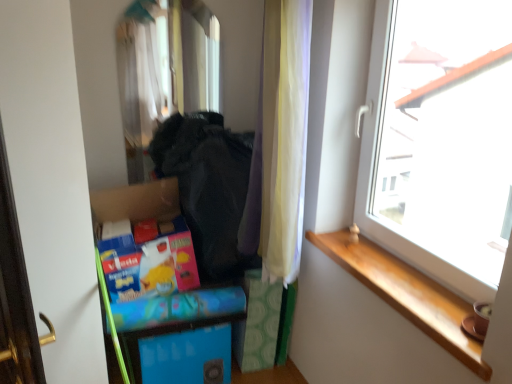
The image size is (512, 384). What do you see at coordinates (280, 144) in the screenshot?
I see `white sheer curtain at center` at bounding box center [280, 144].

Measure the distance between transparent glass window at upper right and camera.

transparent glass window at upper right is 3.89 feet from camera.

Identify the location of white sheer curtain at center. coord(280,144).

Looking at this image, from a real-world perspective, which is physically above, white sheer curtain at center or blue cardboard box at lower center?

white sheer curtain at center.

Consider the image. From the image's perspective, which is below, white sheer curtain at center or blue cardboard box at lower center?

From the image's view, blue cardboard box at lower center is below.

Would you say white sheer curtain at center is inside or outside blue cardboard box at lower center?

white sheer curtain at center cannot be found inside blue cardboard box at lower center.

In the scene shown: Considering the sizes of white sheer curtain at center and blue cardboard box at lower center in the image, is white sheer curtain at center wider or thinner than blue cardboard box at lower center?

Clearly, white sheer curtain at center has more width compared to blue cardboard box at lower center.

Do you think blue cardboard box at lower center is within shiny glass mirror at upper center, or outside of it?

blue cardboard box at lower center is located beyond the bounds of shiny glass mirror at upper center.

What's the angular difference between blue cardboard box at lower center and shiny glass mirror at upper center's facing directions?

The facing directions of blue cardboard box at lower center and shiny glass mirror at upper center are 4.9 degrees apart.

Does blue cardboard box at lower center have a lesser height compared to shiny glass mirror at upper center?

Correct, blue cardboard box at lower center is not as tall as shiny glass mirror at upper center.

Can you confirm if green matte screen door at left is positioned to the right of white sheer curtain at center?

In fact, green matte screen door at left is to the left of white sheer curtain at center.

Is white sheer curtain at center inside green matte screen door at left?

No.

Is green matte screen door at left facing towards white sheer curtain at center?

No, green matte screen door at left is not turned towards white sheer curtain at center.

In the scene shown: In terms of size, does green matte screen door at left appear bigger or smaller than white sheer curtain at center?

green matte screen door at left is bigger than white sheer curtain at center.

Is green matte screen door at left surrounded by shiny glass mirror at upper center?

No, green matte screen door at left is not surrounded by shiny glass mirror at upper center.

Between point (170, 55) and point (32, 90), which one is positioned behind?

The point (170, 55) is farther from the camera.

From their relative heights in the image, would you say shiny glass mirror at upper center is taller or shorter than green matte screen door at left?

Clearly, shiny glass mirror at upper center is shorter compared to green matte screen door at left.

Who is smaller, shiny glass mirror at upper center or green matte screen door at left?

shiny glass mirror at upper center.

Could you tell me if green matte screen door at left is facing transparent glass window at upper right?

No, green matte screen door at left is not facing towards transparent glass window at upper right.

Is transparent glass window at upper right surrounded by green matte screen door at left?

No, transparent glass window at upper right is located outside of green matte screen door at left.

Which is behind, green matte screen door at left or transparent glass window at upper right?

transparent glass window at upper right is further away from the camera.

From a real-world perspective, which object stands above the other?

From a 3D spatial view, shiny glass mirror at upper center is above.

From the image's perspective, is white sheer curtain at center above or below shiny glass mirror at upper center?

From the image's perspective, white sheer curtain at center appears below shiny glass mirror at upper center.

The width and height of the screenshot is (512, 384). I want to click on mirror on the left side of white sheer curtain at center, so click(x=164, y=70).

Is white sheer curtain at center to the right of shiny glass mirror at upper center from the viewer's perspective?

Yes, white sheer curtain at center is to the right of shiny glass mirror at upper center.

Which of these two, transparent glass window at upper right or wooden at right, is thinner?

With smaller width is transparent glass window at upper right.

Would you say transparent glass window at upper right is a long distance from wooden at right?

No, transparent glass window at upper right is not far away from wooden at right.

In the scene shown: Does transparent glass window at upper right have a larger size compared to wooden at right?

Yes.

The height and width of the screenshot is (384, 512). I want to click on window sill behind the transparent glass window at upper right, so click(x=406, y=293).

Identify the location of curtain on the right side of blue cardboard box at lower center. The width and height of the screenshot is (512, 384). (280, 144).

At what (x,y) coordinates should I click in order to perform the action: click on mirror that appears behind the blue cardboard box at lower center. Please return your answer as a coordinate pair (x, y). The image size is (512, 384). Looking at the image, I should click on tap(164, 70).

Looking at the image, which one is located further to white sheer curtain at center, black fabric at center or wooden at right?

wooden at right is positioned further to the anchor white sheer curtain at center.

Considering their positions, is blue cardboard box at lower center positioned further to black fabric at center than shiny glass mirror at upper center?

Among the two, blue cardboard box at lower center is located further to black fabric at center.

Based on their spatial positions, is transparent glass window at upper right or black fabric at center further from wooden at right?

Based on the image, black fabric at center appears to be further to wooden at right.

Which object lies nearer to the anchor point transparent glass window at upper right, shiny glass mirror at upper center or blue cardboard box at lower center?

Based on the image, blue cardboard box at lower center appears to be nearer to transparent glass window at upper right.

Based on their spatial positions, is wooden at right or blue cardboard box at lower center closer to white sheer curtain at center?

wooden at right is closer to white sheer curtain at center.

Consider the image. When comparing their distances from green matte screen door at left, does transparent glass window at upper right or blue cardboard box at lower center seem further?

Among the two, transparent glass window at upper right is located further to green matte screen door at left.

Looking at the image, which one is located further to green matte screen door at left, black fabric at center or blue cardboard box at lower center?

black fabric at center.

Which object lies nearer to the anchor point wooden at right, green matte screen door at left or white sheer curtain at center?

Among the two, white sheer curtain at center is located nearer to wooden at right.

Where is `window sill between white sheer curtain at center and blue cardboard box at lower center in the up-down direction`? window sill between white sheer curtain at center and blue cardboard box at lower center in the up-down direction is located at coordinates tap(406, 293).

Where is `window between green matte screen door at left and blue cardboard box at lower center from front to back`? window between green matte screen door at left and blue cardboard box at lower center from front to back is located at coordinates (440, 140).

Identify the location of curtain between black fabric at center and wooden at right. This screenshot has width=512, height=384. (280, 144).

Identify the location of clothing between transparent glass window at upper right and blue cardboard box at lower center along the z-axis. (208, 186).